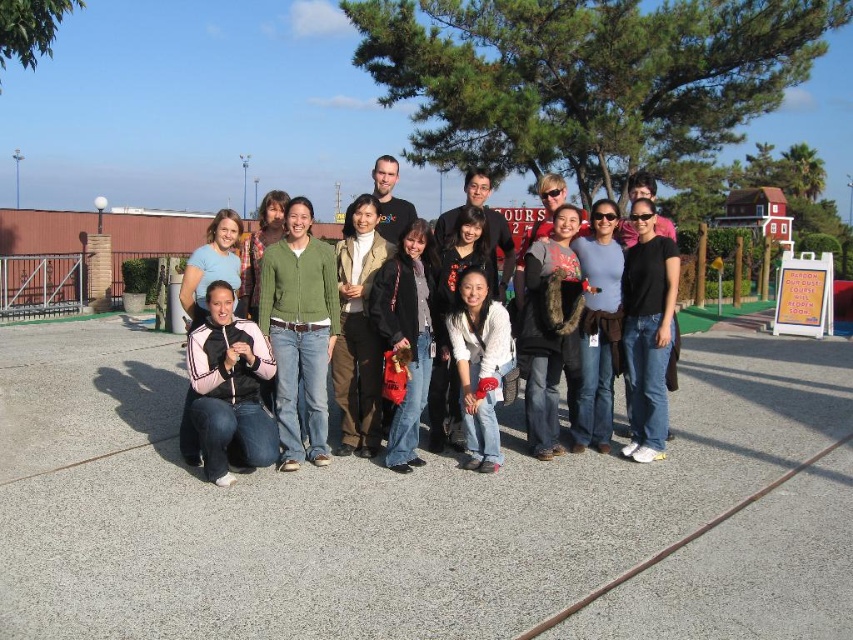
You are a photographer trying to adjust the focus of your camera to capture both the matte black jacket at center and the floral fabric shirt at center clearly. Since the camera can only focus on one height at a time, which object should you prioritize focusing on to ensure the taller one is sharp?

The matte black jacket at center is taller than the floral fabric shirt at center, so you should prioritize focusing on the matte black jacket at center to ensure the taller one is sharp.